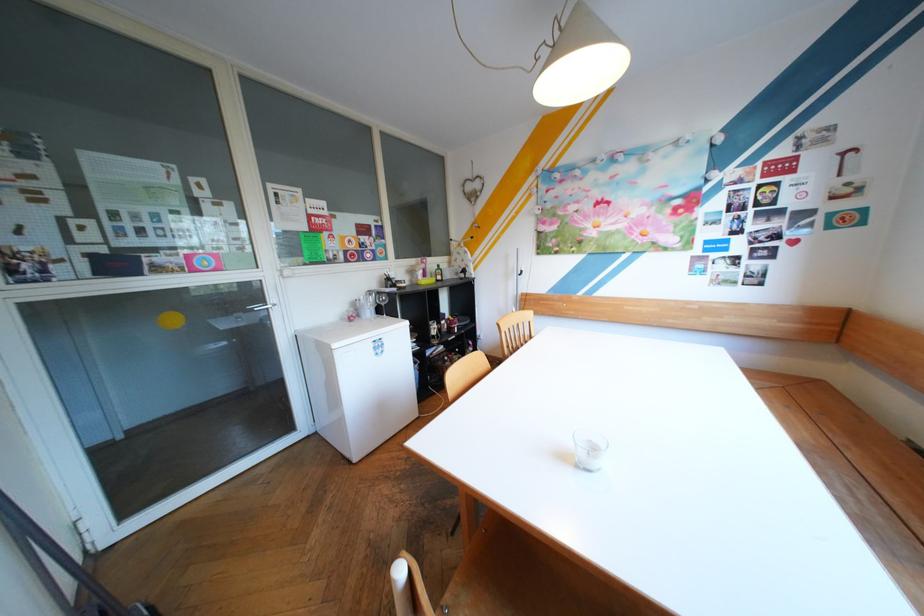
The location [382,301] corresponds to which object?

It corresponds to the wine glass in the image.